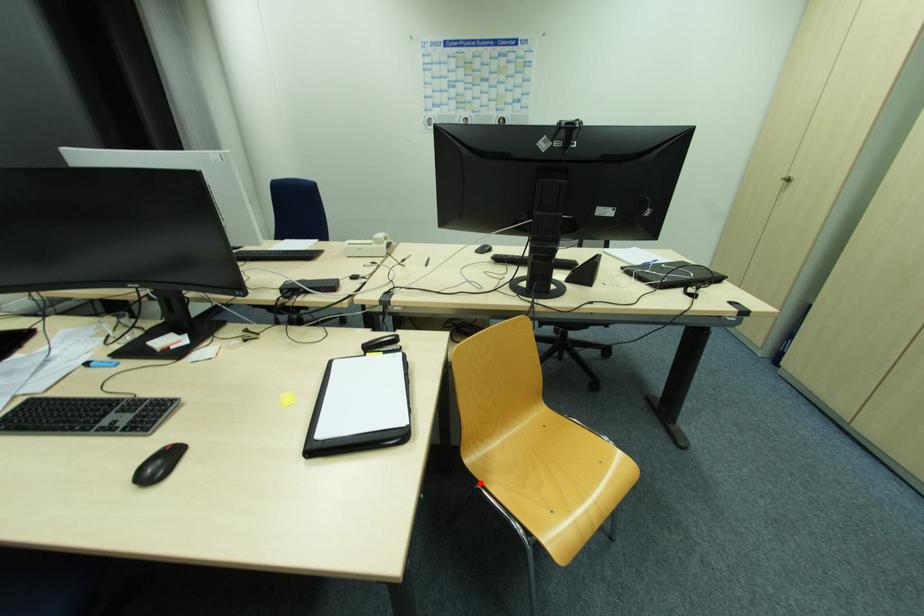
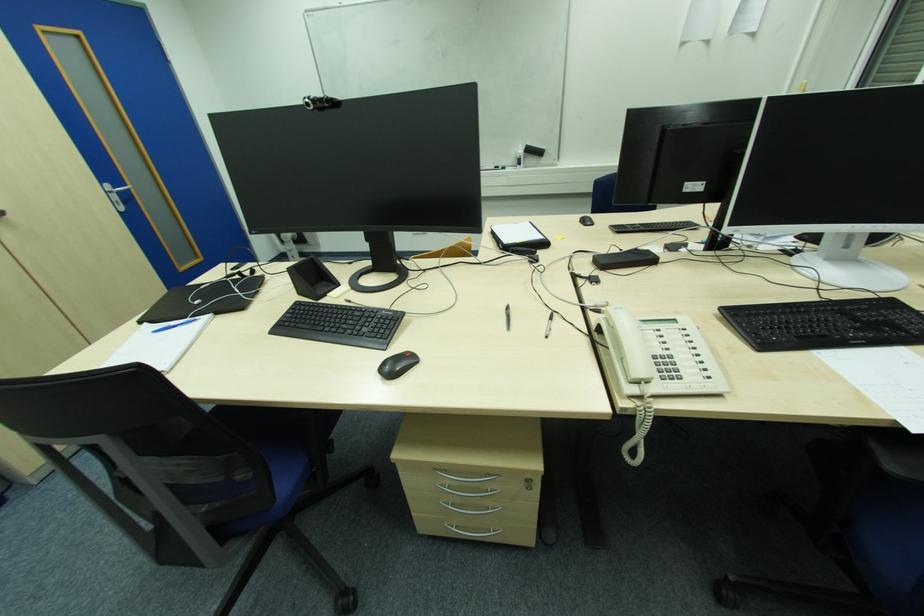
Question: I am providing you with two images of the same scene from different viewpoints. A red point is marked on the first image. At the location where the point appears in image 1, is it still visible in image 2?

Choices:
 (A) Yes
 (B) No

Answer: (B)